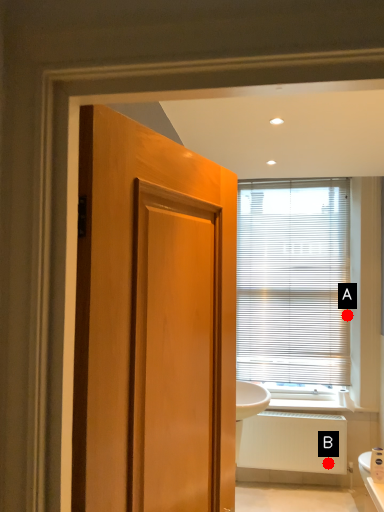
Question: Two points are circled on the image, labeled by A and B beside each circle. Which point is closer to the camera?

Choices:
 (A) A is closer
 (B) B is closer

Answer: (B)